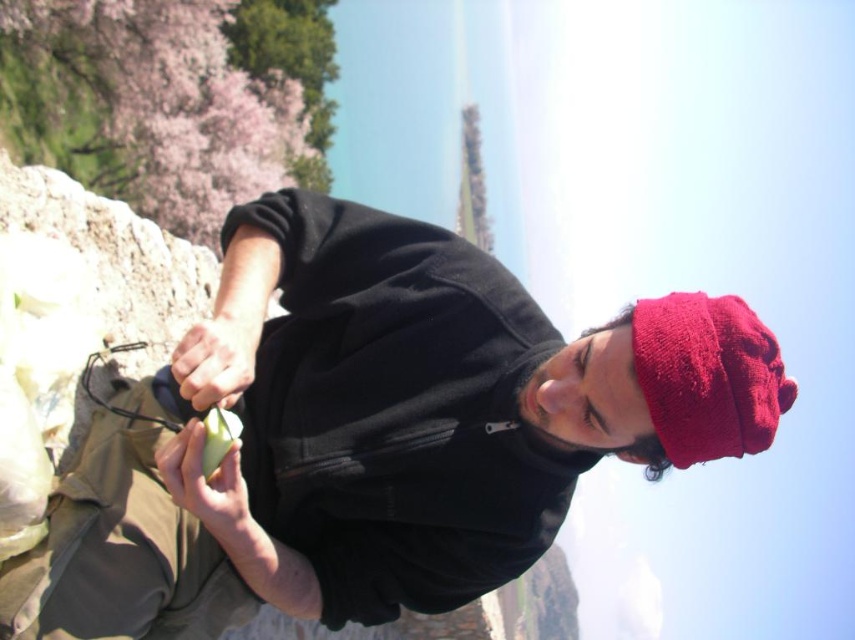
Question: Is matte black hoodie at center smaller than green matte apple at center?

Choices:
 (A) yes
 (B) no

Answer: (B)

Question: Which point appears closest to the camera in this image?

Choices:
 (A) (676, 406)
 (B) (732, 396)

Answer: (B)

Question: Is matte black hoodie at center to the left of smooth green leaf at center from the viewer's perspective?

Choices:
 (A) no
 (B) yes

Answer: (A)

Question: Does red fuzzy hat at upper right have a smaller size compared to green matte apple at center?

Choices:
 (A) yes
 (B) no

Answer: (B)

Question: Which is nearer to the matte black hoodie at center?

Choices:
 (A) red fuzzy hat at upper right
 (B) green matte apple at center
 (C) smooth green leaf at center

Answer: (B)

Question: Which point appears farthest from the camera in this image?

Choices:
 (A) (762, 324)
 (B) (213, 371)
 (C) (181, 474)
 (D) (615, 422)

Answer: (B)